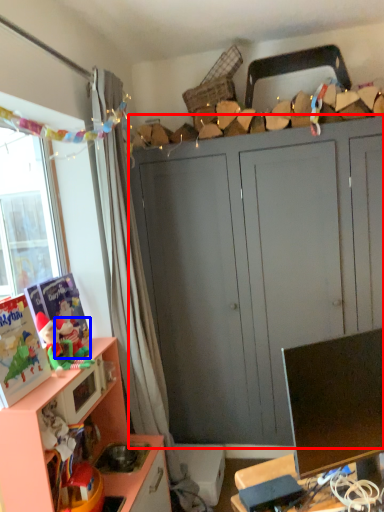
Question: Which object appears closest to the camera in this image, cabinetry (highlighted by a red box) or toy (highlighted by a blue box)?

Choices:
 (A) cabinetry
 (B) toy

Answer: (B)